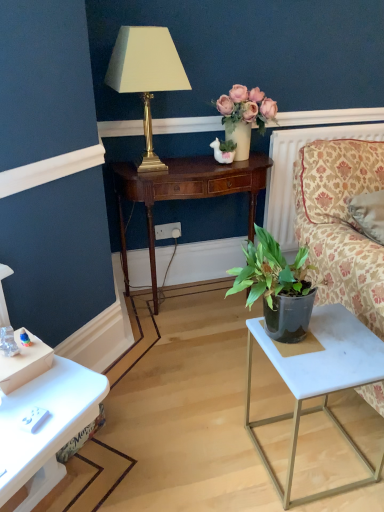
The image size is (384, 512). Find the location of `vacant area situated to the left side of white marble side table at lower right`. vacant area situated to the left side of white marble side table at lower right is located at coordinates (205, 448).